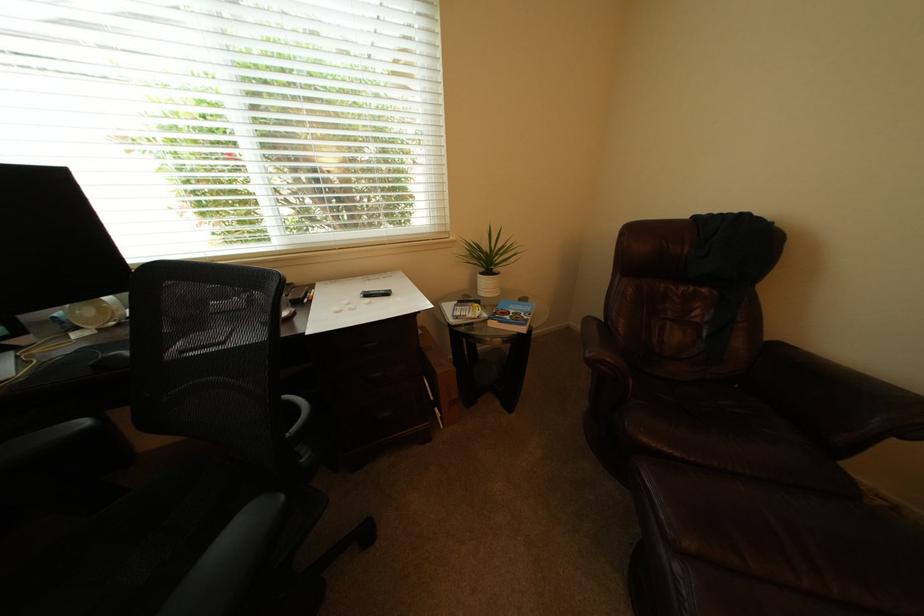
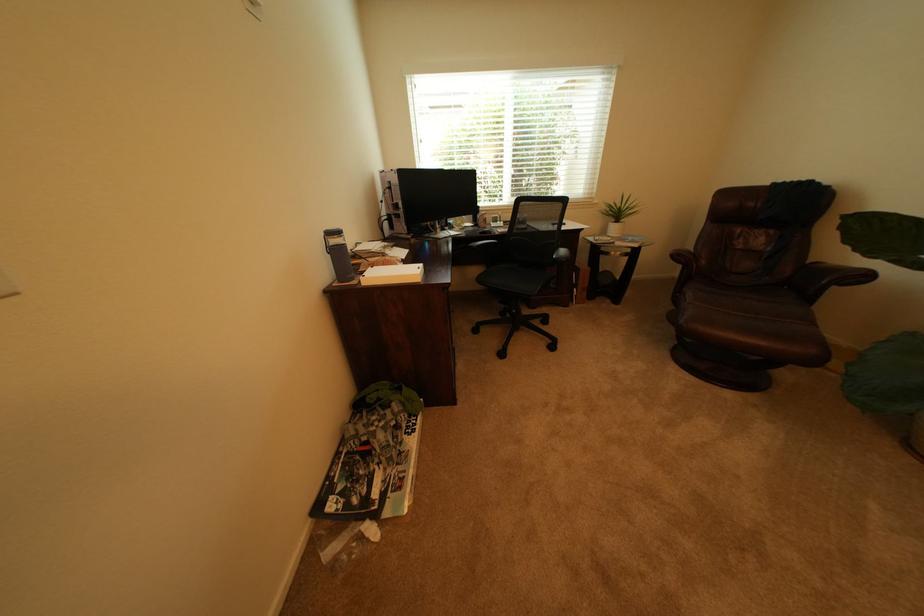
Locate, in the second image, the point that corresponds to the point at 774,341 in the first image.

(821, 262)